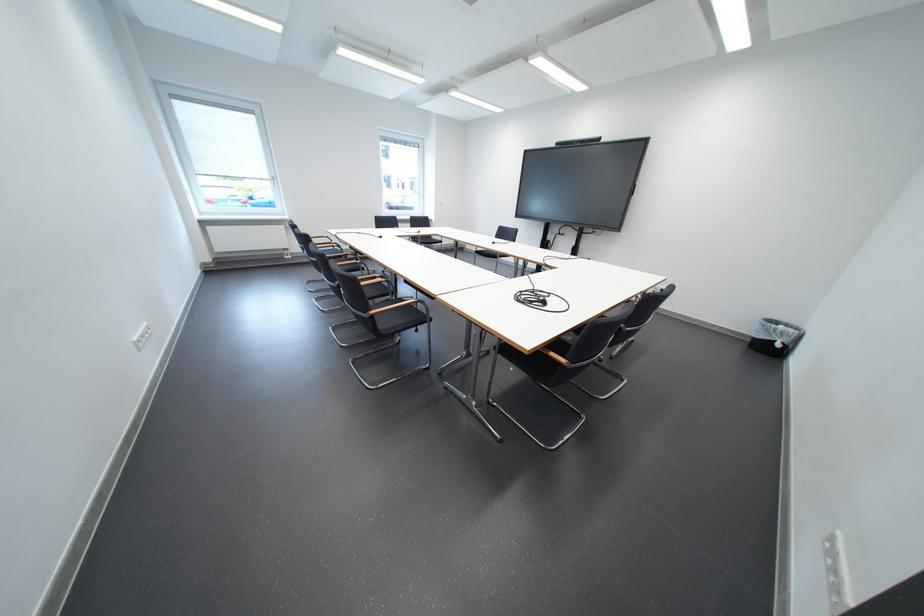
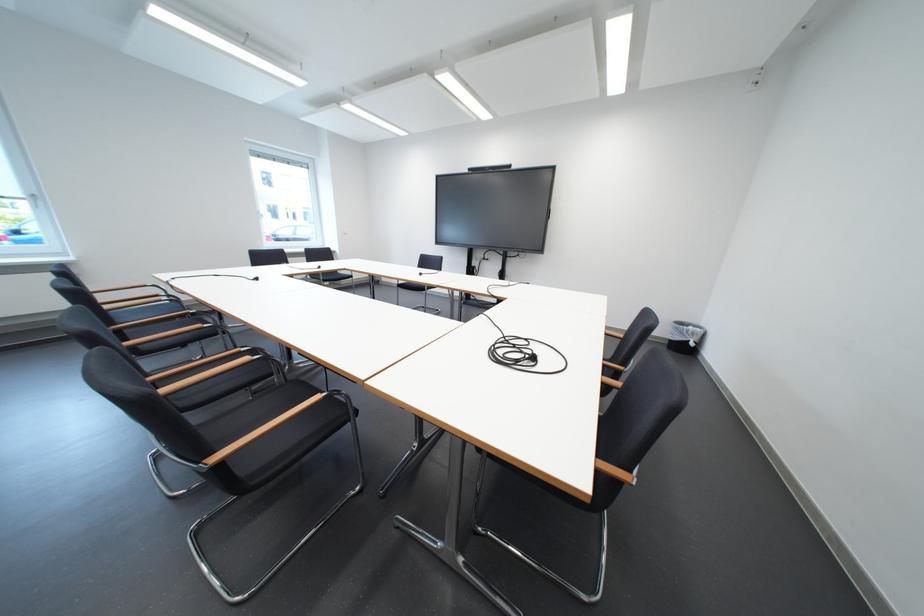
Question: What movement of the cameraman would produce the second image?

Choices:
 (A) Left
 (B) Right
 (C) Forward
 (D) Backward

Answer: (C)